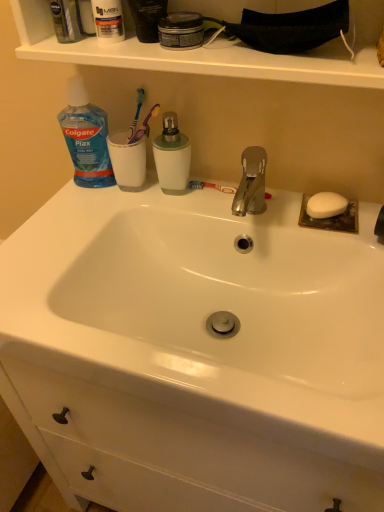
Locate an element on the screen. The image size is (384, 512). vacant space that is to the left of white matte soap at right is located at coordinates (251, 209).